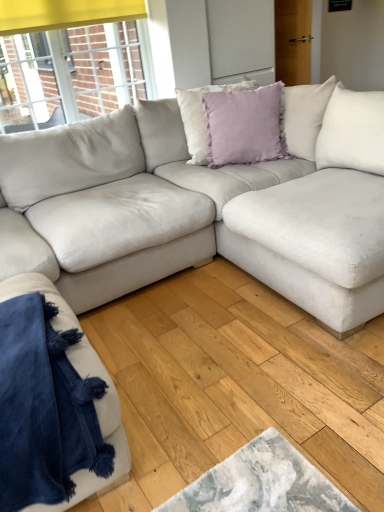
Question: Which direction should I rotate to look at lavender velvet pillow at center, the first pillow positioned from the back, — up or down?

Choices:
 (A) down
 (B) up

Answer: (B)

Question: Can you confirm if lavender velvet pillow at upper center, which is the 1th pillow from front to back, is thinner than lavender velvet pillow at center, the first pillow positioned from the back?

Choices:
 (A) no
 (B) yes

Answer: (B)

Question: Is lavender velvet pillow at upper center, the 2th pillow when ordered from back to front, located outside lavender velvet pillow at center, the first pillow positioned from the back?

Choices:
 (A) no
 (B) yes

Answer: (B)

Question: Can you confirm if lavender velvet pillow at upper center, the 2th pillow when ordered from back to front, is positioned to the left of lavender velvet pillow at center, the first pillow positioned from the back?

Choices:
 (A) yes
 (B) no

Answer: (B)

Question: Is lavender velvet pillow at upper center, which is the 1th pillow from front to back, taller than lavender velvet pillow at center, marked as the second pillow in a front-to-back arrangement?

Choices:
 (A) no
 (B) yes

Answer: (A)

Question: Considering the relative positions of lavender velvet pillow at upper center, which is the 1th pillow from front to back, and lavender velvet pillow at center, marked as the second pillow in a front-to-back arrangement, in the image provided, is lavender velvet pillow at upper center, which is the 1th pillow from front to back, to the right of lavender velvet pillow at center, marked as the second pillow in a front-to-back arrangement, from the viewer's perspective?

Choices:
 (A) no
 (B) yes

Answer: (B)

Question: From the image's perspective, is lavender velvet pillow at upper center, the 2th pillow when ordered from back to front, located above lavender velvet pillow at center, the first pillow positioned from the back?

Choices:
 (A) no
 (B) yes

Answer: (A)

Question: From the image's perspective, is lavender velvet pillow at center, the first pillow positioned from the back, located beneath lavender velvet pillow at upper center, which is the 1th pillow from front to back?

Choices:
 (A) yes
 (B) no

Answer: (B)

Question: Are lavender velvet pillow at center, the first pillow positioned from the back, and lavender velvet pillow at upper center, the 2th pillow when ordered from back to front, far apart?

Choices:
 (A) no
 (B) yes

Answer: (A)

Question: From a real-world perspective, is lavender velvet pillow at center, marked as the second pillow in a front-to-back arrangement, positioned under lavender velvet pillow at upper center, the 2th pillow when ordered from back to front, based on gravity?

Choices:
 (A) yes
 (B) no

Answer: (A)

Question: Can you confirm if lavender velvet pillow at center, marked as the second pillow in a front-to-back arrangement, is wider than lavender velvet pillow at upper center, which is the 1th pillow from front to back?

Choices:
 (A) no
 (B) yes

Answer: (B)

Question: Is lavender velvet pillow at center, the first pillow positioned from the back, placed right next to lavender velvet pillow at upper center, the 2th pillow when ordered from back to front?

Choices:
 (A) yes
 (B) no

Answer: (B)

Question: Is lavender velvet pillow at center, the first pillow positioned from the back, facing away from lavender velvet pillow at upper center, the 2th pillow when ordered from back to front?

Choices:
 (A) yes
 (B) no

Answer: (A)

Question: Is lavender velvet pillow at center, marked as the second pillow in a front-to-back arrangement, with velvet blue blanket at lower left?

Choices:
 (A) yes
 (B) no

Answer: (B)